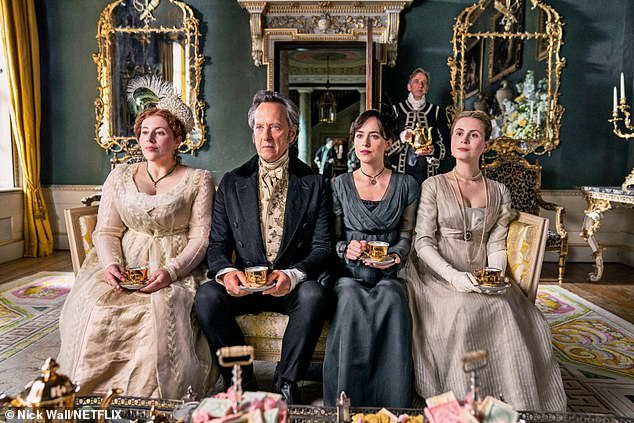
The width and height of the screenshot is (634, 423). I want to click on carpet, so click(30, 321).